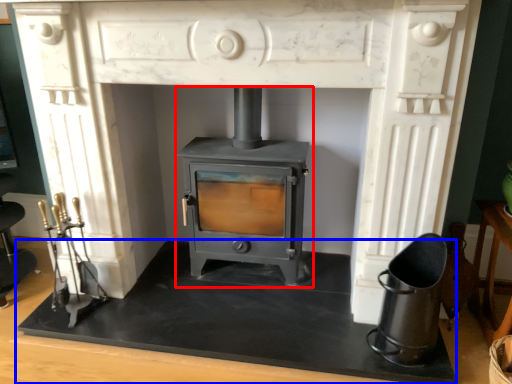
Question: Which object is closer to the camera taking this photo, wood burning stove (highlighted by a red box) or slate (highlighted by a blue box)?

Choices:
 (A) wood burning stove
 (B) slate

Answer: (B)